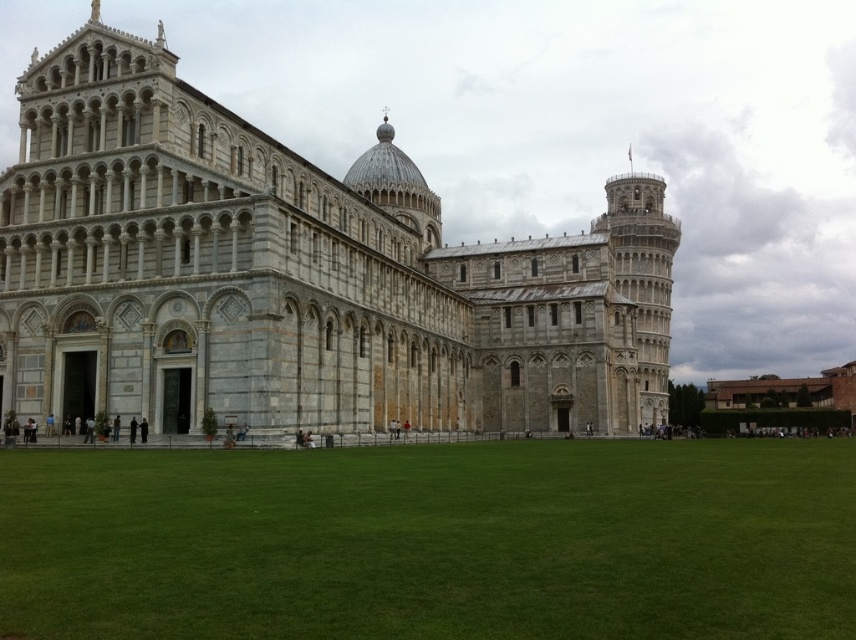
You are a tourist standing in the Piazza dei Miracoli and want to take a photo that includes both the gray stone cathedral at center and the green grass at center. Which object will appear larger in the photo?

The gray stone cathedral at center will appear larger in the photo because it is much taller than the green grass at center.

In the scene shown: You are a tourist standing at the Piazza dei Miracoli in Pisa, Italy. You want to know if the gray stone cathedral at center is wider than the green grass at center. Can you confirm this based on the scene?

The gray stone cathedral at center is wider than the green grass at center according to the description provided.

You are standing at the point marked as point (296,275) in the Piazza dei Miracoli. Which famous structure are you directly in front of?

You are directly in front of the gray stone cathedral at center, which is located at point (296,275).